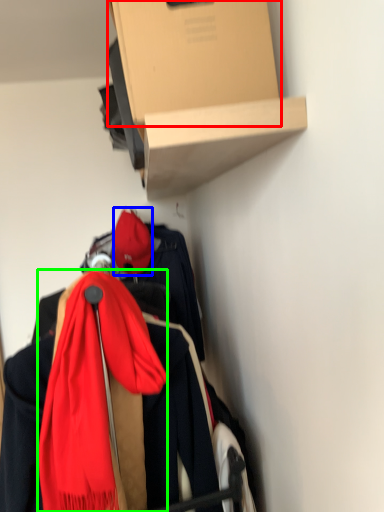
Question: Which object is positioned closest to cardboard box (highlighted by a red box)? Select from hat (highlighted by a blue box) and scarf (highlighted by a green box).

Choices:
 (A) hat
 (B) scarf

Answer: (B)